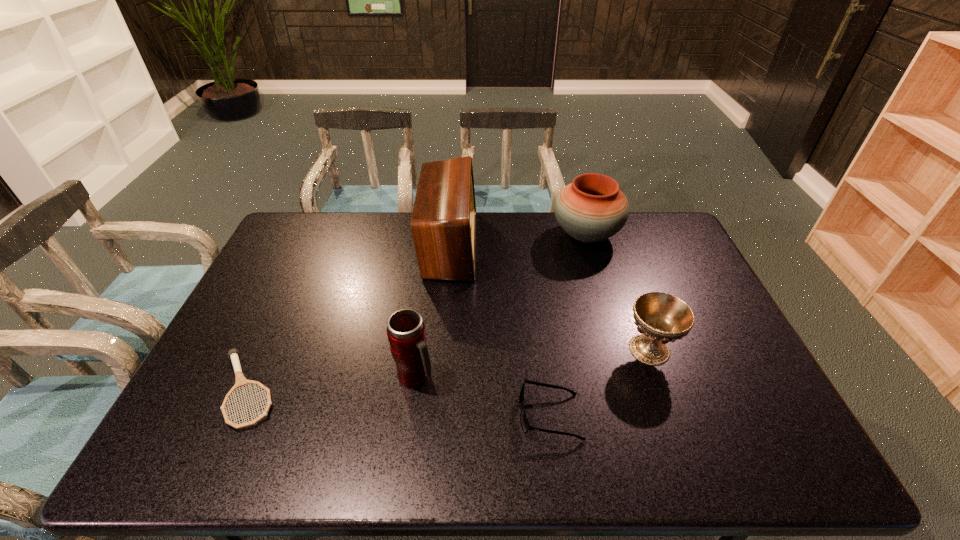
You are a GUI agent. You are given a task and a screenshot of the screen. Output one action in this format:
    pyautogui.click(x=<x>, y=<y>)
    Task: Click on the radio receiver
    This screenshot has width=960, height=540.
    Given the screenshot: What is the action you would take?
    pyautogui.click(x=443, y=223)

Where is `pottery`? pottery is located at coordinates (592, 208).

Find the location of `thermos bottle`. thermos bottle is located at coordinates (406, 333).

Locate an element on the screen. the fourth tallest object is located at coordinates (660, 318).

At what (x,y) coordinates should I click in order to perform the action: click on sunglasses. Please return your answer as a coordinate pair (x, y). Looking at the image, I should click on (524, 422).

The width and height of the screenshot is (960, 540). Find the location of `the fifth tallest object`. the fifth tallest object is located at coordinates (524, 422).

The width and height of the screenshot is (960, 540). Find the location of `tennis racket`. tennis racket is located at coordinates (241, 381).

Image resolution: width=960 pixels, height=540 pixels. In order to click on the shortest object in this screenshot , I will do `click(241, 381)`.

Where is `vacant space located 0.070m on the front-facing side of the radio receiver`? vacant space located 0.070m on the front-facing side of the radio receiver is located at coordinates (495, 245).

At what (x,y) coordinates should I click in order to perform the action: click on free space located on the front of the pottery. Please return your answer as a coordinate pair (x, y). This screenshot has height=540, width=960. Looking at the image, I should click on (610, 314).